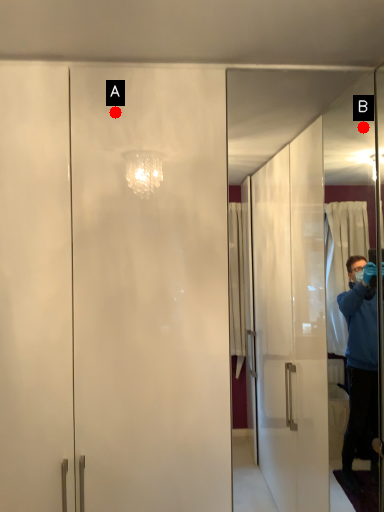
Question: Two points are circled on the image, labeled by A and B beside each circle. Which point is closer to the camera?

Choices:
 (A) A is closer
 (B) B is closer

Answer: (A)